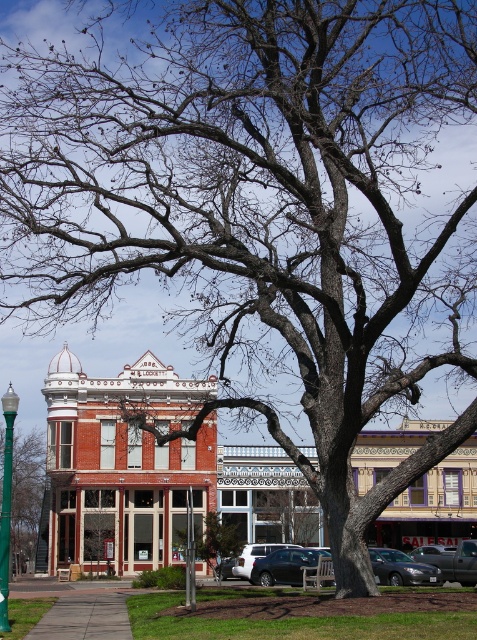
You are a delivery driver who needs to park your silver metallic sedan at center. The parking spot requires that the vehicle must be entirely outside the area under green metallic pole at left for safety reasons. Can you park your vehicle there as it is currently positioned?

The silver metallic sedan at center is currently positioned under the green metallic pole at left, so it cannot be parked there as it violates the safety requirement to stay entirely outside the area under the pole.

You are a delivery person standing on the gray concrete sidewalk at lower left, and you need to reach the satin black sedan at lower right. What is the shortest distance you need to travel to get there?

The shortest distance between the gray concrete sidewalk at lower left and the satin black sedan at lower right is 33.11 meters.